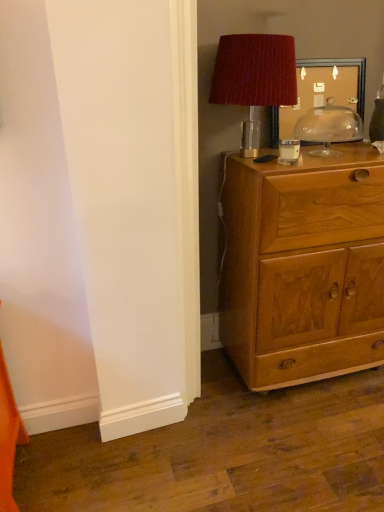
At what (x,y) coordinates should I click in order to perform the action: click on spots to the right of velvet red lampshade at upper right. Please return your answer as a coordinate pair (x, y). Looking at the image, I should click on (341, 156).